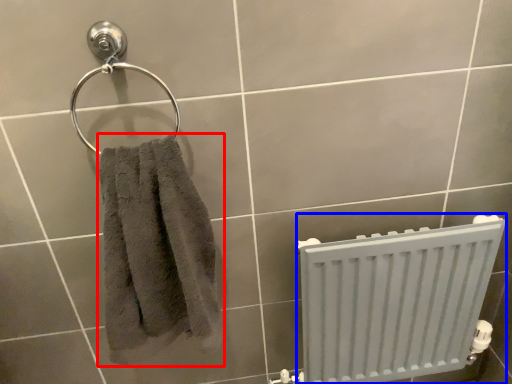
Question: Which object is further to the camera taking this photo, towel (highlighted by a red box) or radiator (highlighted by a blue box)?

Choices:
 (A) towel
 (B) radiator

Answer: (B)